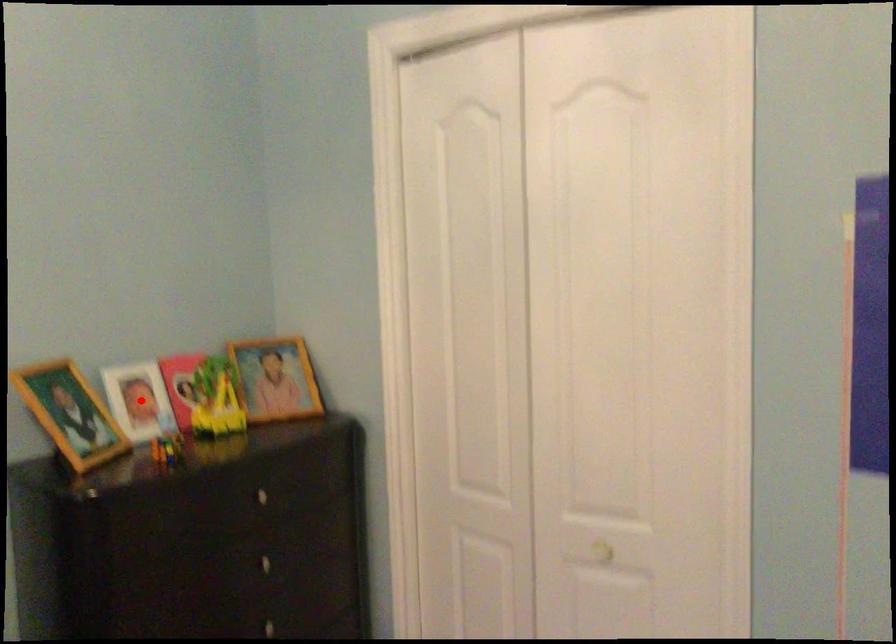
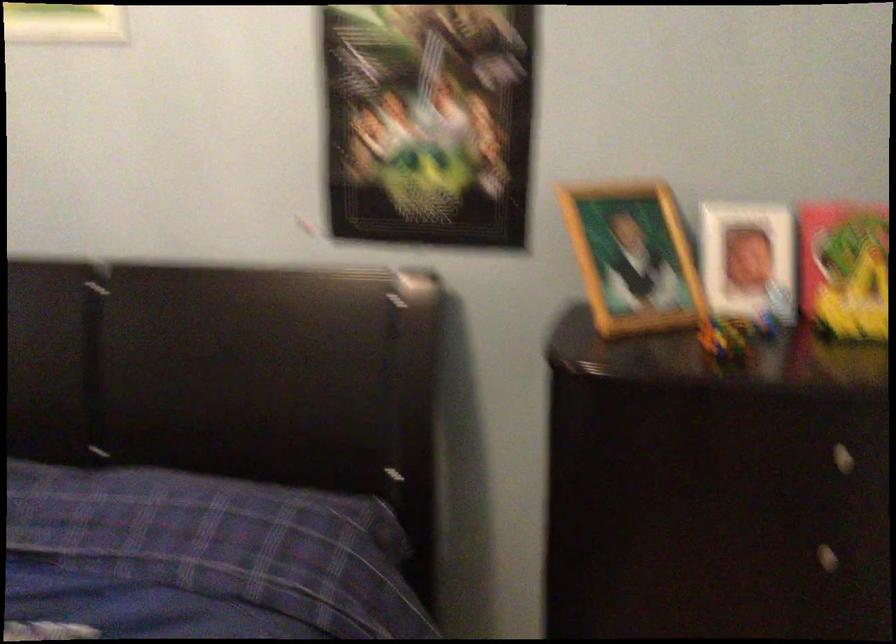
Question: I am providing you with two images of the same scene from different viewpoints. Image1 has a red point marked. In image2, the corresponding 3D location appears at what relative position? Reply with the corresponding letter.

Choices:
 (A) Closer
 (B) Farther

Answer: (A)